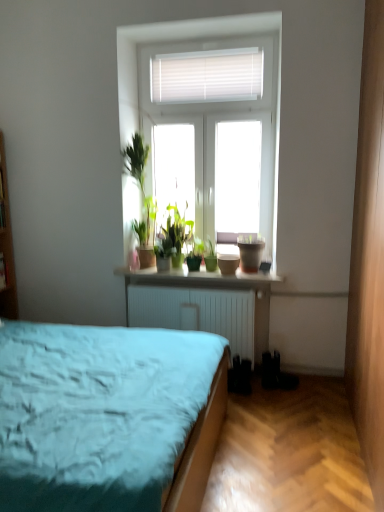
In order to face matte brown flowerpot at window, should I rotate leftwards or rightwards?

Rotate your view right by about 8.031°.

The image size is (384, 512). What do you see at coordinates (195, 254) in the screenshot?
I see `green matte plant at center, acting as the second houseplant starting from the right` at bounding box center [195, 254].

Describe the element at coordinates (195, 277) in the screenshot. I see `matte ceramic pots at center` at that location.

Where is `green matte plant at center, marked as the 1th houseplant in a right-to-left arrangement`? green matte plant at center, marked as the 1th houseplant in a right-to-left arrangement is located at coordinates (210, 255).

How distant is matte ceramic pots at center from matte brown flowerpot at window?

matte ceramic pots at center and matte brown flowerpot at window are 12.62 inches apart from each other.

Considering the sizes of matte ceramic pots at center and matte brown flowerpot at window in the image, is matte ceramic pots at center bigger or smaller than matte brown flowerpot at window?

In the image, matte ceramic pots at center appears to be larger than matte brown flowerpot at window.

Is matte ceramic pots at center facing away from matte brown flowerpot at window?

No, matte ceramic pots at center is not facing away from matte brown flowerpot at window.

Considering the sizes of objects matte ceramic pots at center and matte brown flowerpot at window in the image provided, who is shorter, matte ceramic pots at center or matte brown flowerpot at window?

With less height is matte ceramic pots at center.

Are green matte plant at center, marked as the 1th houseplant in a right-to-left arrangement, and green matte plant at center, acting as the second houseplant starting from the right, beside each other?

Indeed, green matte plant at center, marked as the 1th houseplant in a right-to-left arrangement, and green matte plant at center, acting as the second houseplant starting from the right, are beside each other and touching.

From a real-world perspective, is green matte plant at center, marked as the 1th houseplant in a right-to-left arrangement, under green matte plant at center, the 1th houseplant when ordered from left to right?

Yes, from a real-world perspective, green matte plant at center, marked as the 1th houseplant in a right-to-left arrangement, is under green matte plant at center, the 1th houseplant when ordered from left to right.

From the image's perspective, would you say green matte plant at center, marked as the 1th houseplant in a right-to-left arrangement, is shown under green matte plant at center, acting as the second houseplant starting from the right?

Yes.

Is matte ceramic pots at center oriented towards green matte plant at center, marked as the 1th houseplant in a right-to-left arrangement?

No, matte ceramic pots at center is not facing towards green matte plant at center, marked as the 1th houseplant in a right-to-left arrangement.

From the image's perspective, between matte ceramic pots at center and green matte plant at center, which appears as the second houseplant when viewed from the left, which one is located above?

green matte plant at center, which appears as the second houseplant when viewed from the left, appears higher in the image.

Which object is closer to the camera, matte ceramic pots at center or green matte plant at center, which appears as the second houseplant when viewed from the left?

matte ceramic pots at center.

Does matte ceramic pots at center appear on the left side of green matte plant at center, which appears as the second houseplant when viewed from the left?

Indeed, matte ceramic pots at center is positioned on the left side of green matte plant at center, which appears as the second houseplant when viewed from the left.

Who is shorter, matte brown flowerpot at window or matte ceramic pots at center?

matte ceramic pots at center.

From the image's perspective, is matte brown flowerpot at window above or below matte ceramic pots at center?

Clearly, from the image's perspective, matte brown flowerpot at window is above matte ceramic pots at center.

Is matte brown flowerpot at window smaller than matte ceramic pots at center?

Yes, matte brown flowerpot at window is smaller than matte ceramic pots at center.

Considering the sizes of matte brown flowerpot at window and green matte plant at center, acting as the second houseplant starting from the right, in the image, is matte brown flowerpot at window bigger or smaller than green matte plant at center, acting as the second houseplant starting from the right,?

In the image, matte brown flowerpot at window appears to be smaller than green matte plant at center, acting as the second houseplant starting from the right.

Considering the positions of points (241, 246) and (190, 260), is point (241, 246) farther from camera compared to point (190, 260)?

No, (241, 246) is in front of (190, 260).

Can you tell me how much matte brown flowerpot at window and green matte plant at center, acting as the second houseplant starting from the right, differ in facing direction?

matte brown flowerpot at window and green matte plant at center, acting as the second houseplant starting from the right, are facing 0.000533 degrees away from each other.

In the scene shown: From the image's perspective, does matte brown flowerpot at window appear lower than green matte plant at center, the 1th houseplant when ordered from left to right?

Yes, from the image's perspective, matte brown flowerpot at window is beneath green matte plant at center, the 1th houseplant when ordered from left to right.

Can you confirm if green matte plant at center, the 1th houseplant when ordered from left to right, is taller than matte ceramic pots at center?

Indeed, green matte plant at center, the 1th houseplant when ordered from left to right, has a greater height compared to matte ceramic pots at center.

Is point (192, 259) behind point (268, 275)?

That is True.

Is green matte plant at center, acting as the second houseplant starting from the right, positioned before matte ceramic pots at center?

No, it is behind matte ceramic pots at center.

In terms of size, does green matte plant at center, acting as the second houseplant starting from the right, appear bigger or smaller than matte ceramic pots at center?

Clearly, green matte plant at center, acting as the second houseplant starting from the right, is smaller in size than matte ceramic pots at center.

Is point (255, 280) behind point (196, 259)?

No, (255, 280) is closer to viewer.

Is matte ceramic pots at center aimed at green matte plant at center, the 1th houseplant when ordered from left to right?

No.

Is matte ceramic pots at center closer to camera compared to green matte plant at center, acting as the second houseplant starting from the right?

Yes, matte ceramic pots at center is in front of green matte plant at center, acting as the second houseplant starting from the right.

What are the coordinates of `flowerpot on the right of matte ceramic pots at center` in the screenshot? It's located at (250, 252).

Where is `houseplant that appears below the green matte plant at center, acting as the second houseplant starting from the right (from the image's perspective)`? This screenshot has height=512, width=384. houseplant that appears below the green matte plant at center, acting as the second houseplant starting from the right (from the image's perspective) is located at coordinates (210, 255).

When comparing their distances from matte ceramic pots at center, does green matte plant at center, which appears as the second houseplant when viewed from the left, or green matte plant at center, acting as the second houseplant starting from the right, seem closer?

The object closer to matte ceramic pots at center is green matte plant at center, which appears as the second houseplant when viewed from the left.

Looking at the image, which one is located further to matte brown flowerpot at window, matte ceramic pots at center or green matte plant at center, acting as the second houseplant starting from the right?

green matte plant at center, acting as the second houseplant starting from the right, lies further to matte brown flowerpot at window than the other object.

Considering their positions, is green matte plant at center, acting as the second houseplant starting from the right, positioned closer to matte brown flowerpot at window than matte ceramic pots at center?

matte ceramic pots at center lies closer to matte brown flowerpot at window than the other object.

In the scene shown: From the image, which object appears to be farther from matte brown flowerpot at window, green matte plant at center, acting as the second houseplant starting from the right, or green matte plant at center, which appears as the second houseplant when viewed from the left?

green matte plant at center, acting as the second houseplant starting from the right, is positioned further to the anchor matte brown flowerpot at window.

Estimate the real-world distances between objects in this image. Which object is closer to matte brown flowerpot at window, green matte plant at center, which appears as the second houseplant when viewed from the left, or green matte plant at center, the 1th houseplant when ordered from left to right?

green matte plant at center, which appears as the second houseplant when viewed from the left, is positioned closer to the anchor matte brown flowerpot at window.

From the image, which object appears to be nearer to green matte plant at center, which appears as the second houseplant when viewed from the left, matte ceramic pots at center or green matte plant at center, the 1th houseplant when ordered from left to right?

green matte plant at center, the 1th houseplant when ordered from left to right.

Which object lies further to the anchor point green matte plant at center, acting as the second houseplant starting from the right, green matte plant at center, marked as the 1th houseplant in a right-to-left arrangement, or matte ceramic pots at center?

matte ceramic pots at center lies further to green matte plant at center, acting as the second houseplant starting from the right, than the other object.

Based on their spatial positions, is matte ceramic pots at center or green matte plant at center, which appears as the second houseplant when viewed from the left, closer to matte brown flowerpot at window?

Based on the image, green matte plant at center, which appears as the second houseplant when viewed from the left, appears to be nearer to matte brown flowerpot at window.

Image resolution: width=384 pixels, height=512 pixels. Find the location of `houseplant between green matte plant at center, acting as the second houseplant starting from the right, and matte ceramic pots at center, in the vertical direction`. houseplant between green matte plant at center, acting as the second houseplant starting from the right, and matte ceramic pots at center, in the vertical direction is located at coordinates (210, 255).

Identify the location of houseplant located between green matte plant at center, acting as the second houseplant starting from the right, and matte brown flowerpot at window in the left-right direction. This screenshot has height=512, width=384. (210, 255).

The image size is (384, 512). In order to click on window sill between green matte plant at center, the 1th houseplant when ordered from left to right, and matte brown flowerpot at window in this screenshot , I will do `click(195, 277)`.

Locate an element on the screen. houseplant between matte ceramic pots at center and matte brown flowerpot at window is located at coordinates (210, 255).